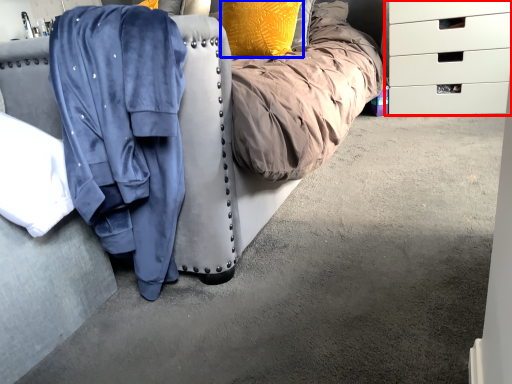
Question: Among these objects, which one is nearest to the camera, chest of drawers (highlighted by a red box) or pillow (highlighted by a blue box)?

Choices:
 (A) chest of drawers
 (B) pillow

Answer: (B)